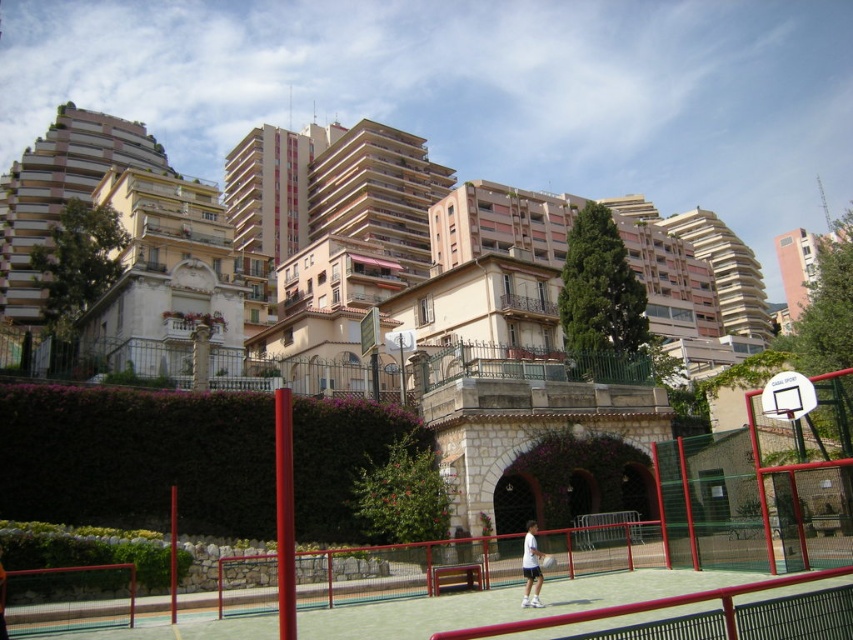
You are a photographer trying to capture both the white cotton shirt at center and the white rubber tennis racket at center in a single frame. Based on their sizes, which object should you focus on to ensure both fit comfortably in the photo?

The white cotton shirt at center might be wider than the white rubber tennis racket at center, so focusing on the shirt would ensure both fit comfortably in the photo.